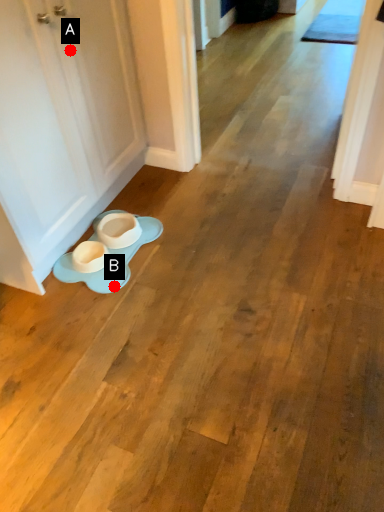
Question: Two points are circled on the image, labeled by A and B beside each circle. Which point is farther to the camera?

Choices:
 (A) A is further
 (B) B is further

Answer: (B)